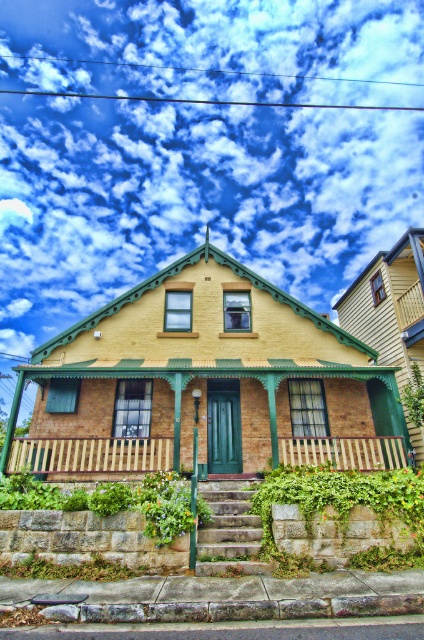
You are a painter planning to paint the scene of the house. You notice the cloudy sky at upper center and the wooden slats at lower center. Which object would you need to paint first if you follow the rule of painting from the top down?

You would need to paint the cloudy sky at upper center first because it is located at the top of the scene, following the top to bottom painting rule.

Looking at this image, you are standing in front of the house and looking at the cloudy sky at upper center and the wooden slats at lower center. Which object appears closer to you?

The wooden slats at lower center appear closer because they are in front of the cloudy sky at upper center.

You are standing in front of the house and notice a specific location marked by coordinates. What object is located at the coordinates point (89, 454)?

The coordinates point (89, 454) indicate wooden planks at center.